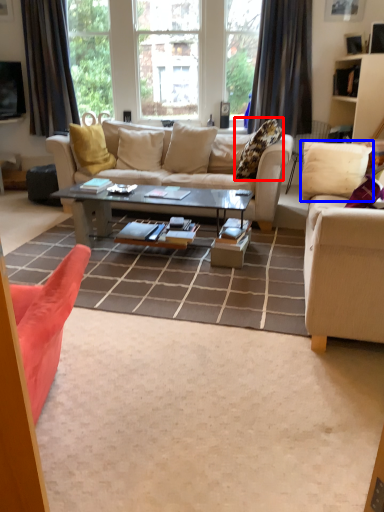
Question: Which object is further to the camera taking this photo, pillow (highlighted by a red box) or pillow (highlighted by a blue box)?

Choices:
 (A) pillow
 (B) pillow

Answer: (A)